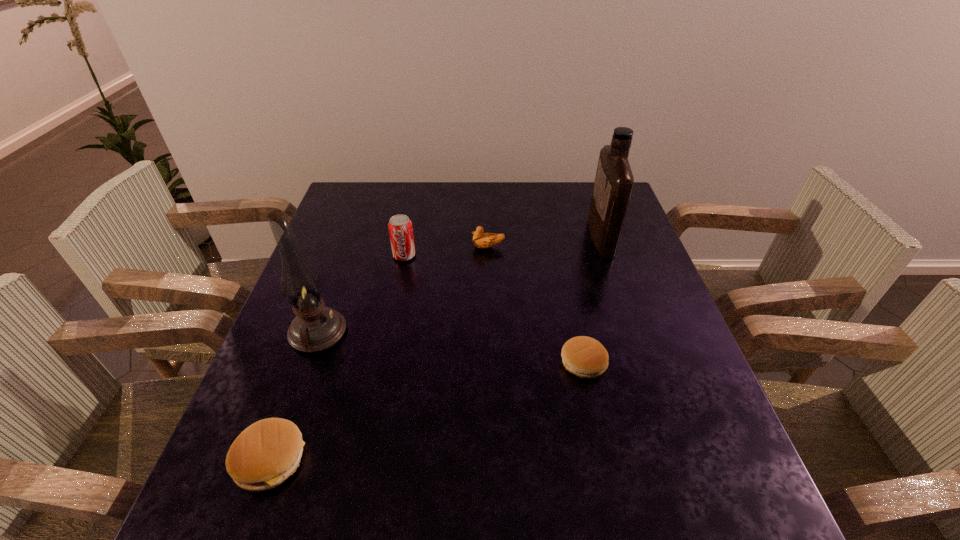
If we want them evenly spaced by inserting an extra patty_(food) among them, please locate a free spot for this new patty_(food). Please provide its 2D coordinates. Your answer should be formatted as a tuple, i.e. [(x, y)], where the tuple contains the x and y coordinates of a point satisfying the conditions above.

[(442, 407)]